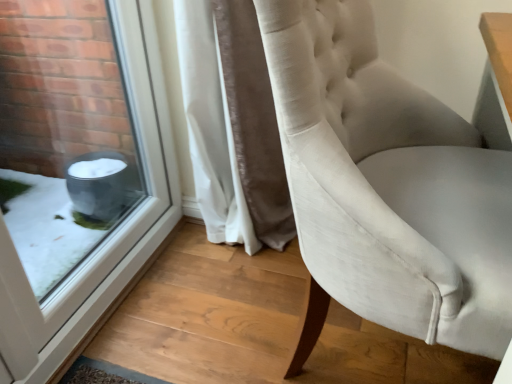
Question: From a real-world perspective, is transparent glass window at lower left beneath white velvet curtain at center?

Choices:
 (A) yes
 (B) no

Answer: (B)

Question: Can you confirm if transparent glass window at lower left is bigger than white velvet curtain at center?

Choices:
 (A) no
 (B) yes

Answer: (A)

Question: Is white velvet curtain at center surrounded by transparent glass window at lower left?

Choices:
 (A) yes
 (B) no

Answer: (B)

Question: Does transparent glass window at lower left appear on the left side of white velvet curtain at center?

Choices:
 (A) no
 (B) yes

Answer: (B)

Question: Is the depth of transparent glass window at lower left greater than that of white velvet curtain at center?

Choices:
 (A) no
 (B) yes

Answer: (A)

Question: Considering the relative positions of white velvet curtain at center and transparent glass window at lower left in the image provided, is white velvet curtain at center to the left or to the right of transparent glass window at lower left?

Choices:
 (A) right
 (B) left

Answer: (A)

Question: From a real-world perspective, relative to transparent glass window at lower left, is white velvet curtain at center vertically above or below?

Choices:
 (A) below
 (B) above

Answer: (A)

Question: Considering the positions of white velvet curtain at center and transparent glass window at lower left in the image, is white velvet curtain at center bigger or smaller than transparent glass window at lower left?

Choices:
 (A) big
 (B) small

Answer: (A)

Question: From the image's perspective, is white velvet curtain at center positioned above or below transparent glass window at lower left?

Choices:
 (A) below
 (B) above

Answer: (B)

Question: Is white velvet curtain at center spatially inside satin white chair at center, or outside of it?

Choices:
 (A) inside
 (B) outside

Answer: (B)

Question: Looking at their shapes, would you say white velvet curtain at center is wider or thinner than satin white chair at center?

Choices:
 (A) wide
 (B) thin

Answer: (B)

Question: From a real-world perspective, is white velvet curtain at center positioned above or below satin white chair at center?

Choices:
 (A) above
 (B) below

Answer: (B)

Question: Considering the positions of white velvet curtain at center and satin white chair at center in the image, is white velvet curtain at center taller or shorter than satin white chair at center?

Choices:
 (A) short
 (B) tall

Answer: (A)

Question: Would you say transparent glass window at lower left is to the left or to the right of satin white chair at center in the picture?

Choices:
 (A) right
 (B) left

Answer: (B)

Question: From a real-world perspective, is transparent glass window at lower left above or below satin white chair at center?

Choices:
 (A) above
 (B) below

Answer: (A)